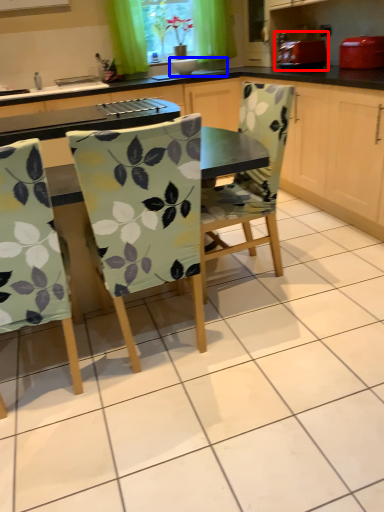
Question: Which of the following is the closest to the observer, appliance (highlighted by a red box) or sink (highlighted by a blue box)?

Choices:
 (A) appliance
 (B) sink

Answer: (A)